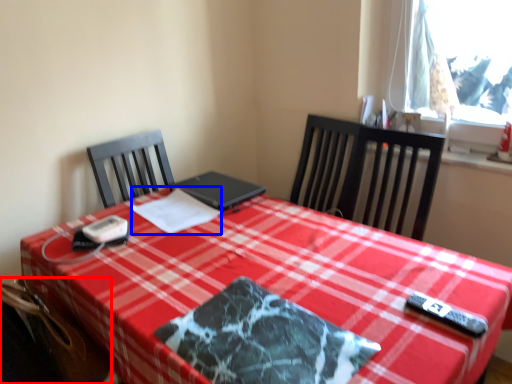
Question: Among these objects, which one is farthest to the camera, swivel chair (highlighted by a red box) or linen (highlighted by a blue box)?

Choices:
 (A) swivel chair
 (B) linen

Answer: (B)